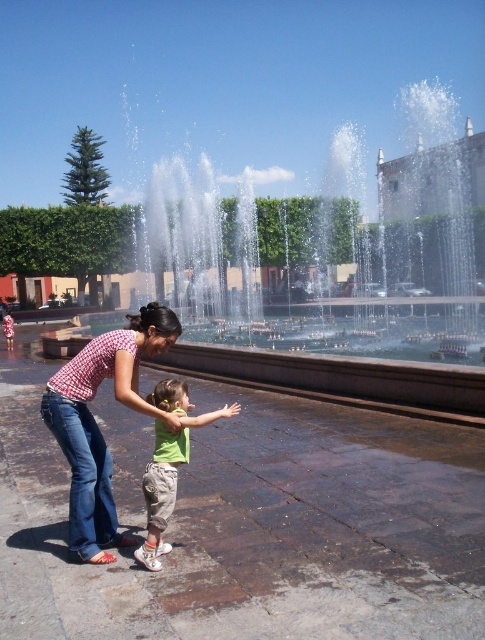
Between clear water jets at center and green fabric shirt at center, which one is positioned higher?

Positioned higher is clear water jets at center.

Which is more to the left, clear water jets at center or green fabric shirt at center?

Positioned to the left is green fabric shirt at center.

Is point (190, 296) positioned in front of point (175, 480)?

No, (190, 296) is further to viewer.

Locate an element on the screen. This screenshot has height=640, width=485. clear water jets at center is located at coordinates (359, 264).

Between clear water jets at center and denim jeans at center, which one is positioned lower?

denim jeans at center is below.

Is clear water jets at center wider than denim jeans at center?

Indeed, clear water jets at center has a greater width compared to denim jeans at center.

Between point (457, 314) and point (114, 337), which one is positioned behind?

Positioned behind is point (457, 314).

Locate an element on the screen. clear water jets at center is located at coordinates pos(359,264).

Between denim jeans at center and green fabric shirt at center, which one appears on the left side from the viewer's perspective?

From the viewer's perspective, denim jeans at center appears more on the left side.

Can you confirm if denim jeans at center is wider than green fabric shirt at center?

No, denim jeans at center is not wider than green fabric shirt at center.

The image size is (485, 640). What do you see at coordinates (97, 424) in the screenshot? I see `denim jeans at center` at bounding box center [97, 424].

This screenshot has height=640, width=485. Find the location of `denim jeans at center`. denim jeans at center is located at coordinates (97, 424).